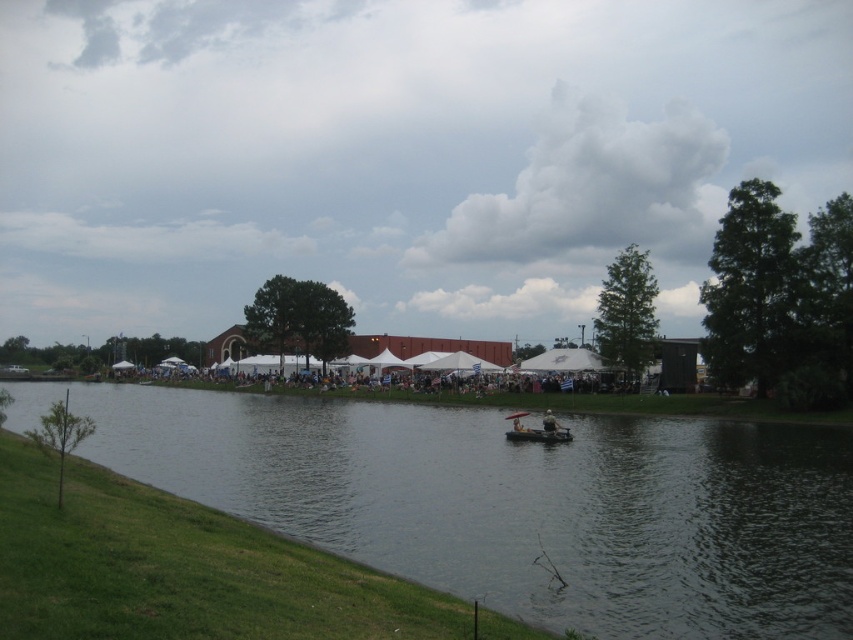
Does clear water at center lie behind light brown wooden bench at center?

No, clear water at center is closer to the viewer.

Is clear water at center shorter than light brown wooden bench at center?

No, clear water at center is not shorter than light brown wooden bench at center.

I want to click on clear water at center, so click(x=514, y=500).

Measure the distance between clear water at center and dark brown wooden canoe at center.

clear water at center is 17.14 meters away from dark brown wooden canoe at center.

Does clear water at center appear over dark brown wooden canoe at center?

Correct, clear water at center is located above dark brown wooden canoe at center.

What do you see at coordinates (514, 500) in the screenshot?
I see `clear water at center` at bounding box center [514, 500].

This screenshot has height=640, width=853. I want to click on clear water at center, so click(x=514, y=500).

Which is below, wooden canoe at center or dark brown wooden canoe at center?

Positioned lower is wooden canoe at center.

Which is behind, point (535, 436) or point (566, 429)?

Positioned behind is point (566, 429).

Where is `wooden canoe at center`? The width and height of the screenshot is (853, 640). wooden canoe at center is located at coordinates (537, 429).